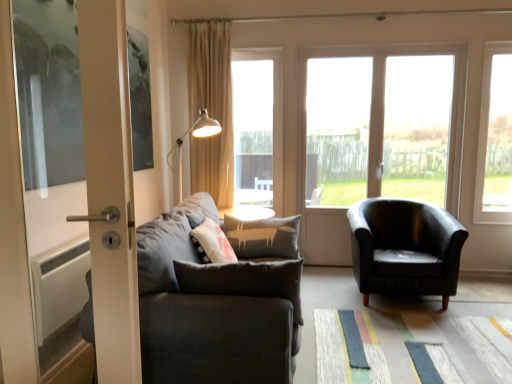
You are a GUI agent. You are given a task and a screenshot of the screen. Output one action in this format:
    pyautogui.click(x=<x>, y=<y>)
    Task: Click on the beige fabric curtain at upper center
    The image size is (512, 384).
    Given the screenshot: What is the action you would take?
    pyautogui.click(x=211, y=109)

What do you see at coordinates (417, 126) in the screenshot? This screenshot has height=384, width=512. I see `transparent glass window at center` at bounding box center [417, 126].

What do you see at coordinates (384, 125) in the screenshot? I see `transparent glass door at center, the third window viewed from the left` at bounding box center [384, 125].

The height and width of the screenshot is (384, 512). I want to click on transparent glass window at center, which is the 2th window from left to right, so click(338, 129).

The height and width of the screenshot is (384, 512). What are the coordinates of `dark gray fabric couch at left` in the screenshot? It's located at (213, 308).

Where is `transparent glass window at right, the fourth window viewed from the left`? transparent glass window at right, the fourth window viewed from the left is located at coordinates (495, 138).

Between dark gray fabric couch at left and transparent glass window at center, the 1th window viewed from the left, which one has smaller width?

Thinner between the two is transparent glass window at center, the 1th window viewed from the left.

Considering the sizes of dark gray fabric couch at left and transparent glass window at center, the 1th window viewed from the left, in the image, is dark gray fabric couch at left taller or shorter than transparent glass window at center, the 1th window viewed from the left,?

Clearly, dark gray fabric couch at left is shorter compared to transparent glass window at center, the 1th window viewed from the left.

Which object is further away from the camera, dark gray fabric couch at left or transparent glass window at center, which is counted as the 4th window, starting from the right?

transparent glass window at center, which is counted as the 4th window, starting from the right, is further from the camera.

From the image's perspective, relative to transparent glass window at center, the 1th window viewed from the left, is dark gray fabric couch at left above or below?

Based on their image positions, dark gray fabric couch at left is located beneath transparent glass window at center, the 1th window viewed from the left.

From a real-world perspective, is transparent glass window at right, the fourth window viewed from the left, positioned above or below textured multicolored mat at lower center?

transparent glass window at right, the fourth window viewed from the left, is above textured multicolored mat at lower center.

How many degrees apart are the facing directions of transparent glass window at right, which is the 1th window in right-to-left order, and textured multicolored mat at lower center?

The angular difference between transparent glass window at right, which is the 1th window in right-to-left order, and textured multicolored mat at lower center is 88.3 degrees.

Image resolution: width=512 pixels, height=384 pixels. Find the location of `mat below the transparent glass window at right, which is the 1th window in right-to-left order (from the image's perspective)`. mat below the transparent glass window at right, which is the 1th window in right-to-left order (from the image's perspective) is located at coordinates (415, 341).

Considering the sizes of objects transparent glass window at right, which is the 1th window in right-to-left order, and textured multicolored mat at lower center in the image provided, who is smaller, transparent glass window at right, which is the 1th window in right-to-left order, or textured multicolored mat at lower center?

textured multicolored mat at lower center.

Where is `window above the transparent glass window at right, the fourth window viewed from the left (from the image's perspective)`? The image size is (512, 384). window above the transparent glass window at right, the fourth window viewed from the left (from the image's perspective) is located at coordinates (258, 126).

Does transparent glass window at center, the 1th window viewed from the left, appear on the left side of transparent glass window at right, which is the 1th window in right-to-left order?

Yes, transparent glass window at center, the 1th window viewed from the left, is to the left of transparent glass window at right, which is the 1th window in right-to-left order.

From the image's perspective, which object appears higher, transparent glass window at center, the 1th window viewed from the left, or transparent glass window at right, which is the 1th window in right-to-left order?

From the image's view, transparent glass window at center, the 1th window viewed from the left, is above.

Who is bigger, matte black armchair at center right or transparent glass door at center, the third window viewed from the left?

matte black armchair at center right is bigger.

From the image's perspective, which is above, matte black armchair at center right or transparent glass door at center, which ranks as the 2th window in right-to-left order?

transparent glass door at center, which ranks as the 2th window in right-to-left order, appears higher in the image.

Considering the sizes of objects matte black armchair at center right and transparent glass door at center, which ranks as the 2th window in right-to-left order, in the image provided, who is shorter, matte black armchair at center right or transparent glass door at center, which ranks as the 2th window in right-to-left order,?

With less height is matte black armchair at center right.

Considering the positions of objects matte black armchair at center right and transparent glass door at center, which ranks as the 2th window in right-to-left order, in the image provided, who is more to the right, matte black armchair at center right or transparent glass door at center, which ranks as the 2th window in right-to-left order,?

matte black armchair at center right.

Which of these two, textured multicolored mat at lower center or transparent glass window at center, the 1th window viewed from the left, is smaller?

With smaller size is textured multicolored mat at lower center.

Which is more to the left, textured multicolored mat at lower center or transparent glass window at center, which is counted as the 4th window, starting from the right?

Positioned to the left is transparent glass window at center, which is counted as the 4th window, starting from the right.

Would you consider textured multicolored mat at lower center to be distant from transparent glass window at center, which is counted as the 4th window, starting from the right?

That's right, there is a large distance between textured multicolored mat at lower center and transparent glass window at center, which is counted as the 4th window, starting from the right.

Considering the positions of point (386, 359) and point (243, 201), is point (386, 359) closer or farther from the camera than point (243, 201)?

Clearly, point (386, 359) is closer to the camera than point (243, 201).

From a real-world perspective, is transparent glass window at center, which ranks as the 3th window in right-to-left order, below transparent glass window at right, the fourth window viewed from the left?

Yes, from a real-world perspective, transparent glass window at center, which ranks as the 3th window in right-to-left order, is below transparent glass window at right, the fourth window viewed from the left.

Is transparent glass window at center, which is the 2th window from left to right, thinner than transparent glass window at right, the fourth window viewed from the left?

Indeed, transparent glass window at center, which is the 2th window from left to right, has a lesser width compared to transparent glass window at right, the fourth window viewed from the left.

Which is further, (318,160) or (489,200)?

The point (318,160) is farther from the camera.

Considering the relative sizes of transparent glass window at center, which ranks as the 3th window in right-to-left order, and transparent glass window at right, which is the 1th window in right-to-left order, in the image provided, is transparent glass window at center, which ranks as the 3th window in right-to-left order, taller than transparent glass window at right, which is the 1th window in right-to-left order,?

Indeed, transparent glass window at center, which ranks as the 3th window in right-to-left order, has a greater height compared to transparent glass window at right, which is the 1th window in right-to-left order.

Find the location of a particular element. the 3rd window below the transparent glass window at center (from a real-world perspective) is located at coordinates (384, 125).

Does transparent glass door at center, which ranks as the 2th window in right-to-left order, have a lesser width compared to transparent glass window at center?

Yes, transparent glass door at center, which ranks as the 2th window in right-to-left order, is thinner than transparent glass window at center.

In terms of size, does transparent glass door at center, which ranks as the 2th window in right-to-left order, appear bigger or smaller than transparent glass window at center?

In the image, transparent glass door at center, which ranks as the 2th window in right-to-left order, appears to be larger than transparent glass window at center.

Considering the positions of objects transparent glass door at center, which ranks as the 2th window in right-to-left order, and transparent glass window at center in the image provided, who is more to the left, transparent glass door at center, which ranks as the 2th window in right-to-left order, or transparent glass window at center?

transparent glass door at center, which ranks as the 2th window in right-to-left order.

From a real-world perspective, starting from the dark gray fabric couch at left, which window is the 3rd one vertically above it? Please provide its 2D coordinates.

[(258, 126)]

Locate an element on the screen. The image size is (512, 384). mat on the left side of transparent glass window at right, which is the 1th window in right-to-left order is located at coordinates (415, 341).

From the image, which object appears to be farther from transparent glass window at right, which is the 1th window in right-to-left order, textured multicolored mat at lower center or matte black armchair at center right?

textured multicolored mat at lower center.

Considering their positions, is transparent glass window at right, which is the 1th window in right-to-left order, positioned further to transparent glass window at center, which is counted as the 4th window, starting from the right, than dark gray fabric couch at left?

Among the two, dark gray fabric couch at left is located further to transparent glass window at center, which is counted as the 4th window, starting from the right.

Based on their spatial positions, is textured multicolored mat at lower center or transparent glass window at center closer to transparent glass door at center, which ranks as the 2th window in right-to-left order?

The object closer to transparent glass door at center, which ranks as the 2th window in right-to-left order, is transparent glass window at center.

Estimate the real-world distances between objects in this image. Which object is closer to beige fabric curtain at upper center, transparent glass door at center, the third window viewed from the left, or transparent glass window at center?

transparent glass door at center, the third window viewed from the left.

From the image, which object appears to be farther from dark gray fabric couch at left, matte black armchair at center right or transparent glass window at center, which is counted as the 4th window, starting from the right?

transparent glass window at center, which is counted as the 4th window, starting from the right, is further to dark gray fabric couch at left.

When comparing their distances from beige fabric curtain at upper center, does transparent glass window at center or transparent glass window at center, which is the 2th window from left to right, seem closer?

transparent glass window at center, which is the 2th window from left to right, is positioned closer to the anchor beige fabric curtain at upper center.

Based on their spatial positions, is beige fabric curtain at upper center or transparent glass window at right, which is the 1th window in right-to-left order, closer to transparent glass window at center, which ranks as the 3th window in right-to-left order?

Among the two, beige fabric curtain at upper center is located nearer to transparent glass window at center, which ranks as the 3th window in right-to-left order.

Based on their spatial positions, is transparent glass window at right, which is the 1th window in right-to-left order, or beige fabric curtain at upper center closer to transparent glass window at center, the 1th window viewed from the left?

The object closer to transparent glass window at center, the 1th window viewed from the left, is beige fabric curtain at upper center.

Locate an element on the screen. window frame positioned between dark gray fabric couch at left and transparent glass window at center, which ranks as the 3th window in right-to-left order, from near to far is located at coordinates (417, 126).

What are the coordinates of `chair between textured multicolored mat at lower center and transparent glass window at right, the fourth window viewed from the left, from front to back` in the screenshot? It's located at (405, 248).

At what (x,y) coordinates should I click in order to perform the action: click on chair located between transparent glass door at center, the third window viewed from the left, and transparent glass window at right, which is the 1th window in right-to-left order, in the left-right direction. Please return your answer as a coordinate pair (x, y). The image size is (512, 384). Looking at the image, I should click on (405, 248).

At what (x,y) coordinates should I click in order to perform the action: click on mat situated between beige fabric curtain at upper center and matte black armchair at center right from left to right. Please return your answer as a coordinate pair (x, y). The height and width of the screenshot is (384, 512). Looking at the image, I should click on (415, 341).